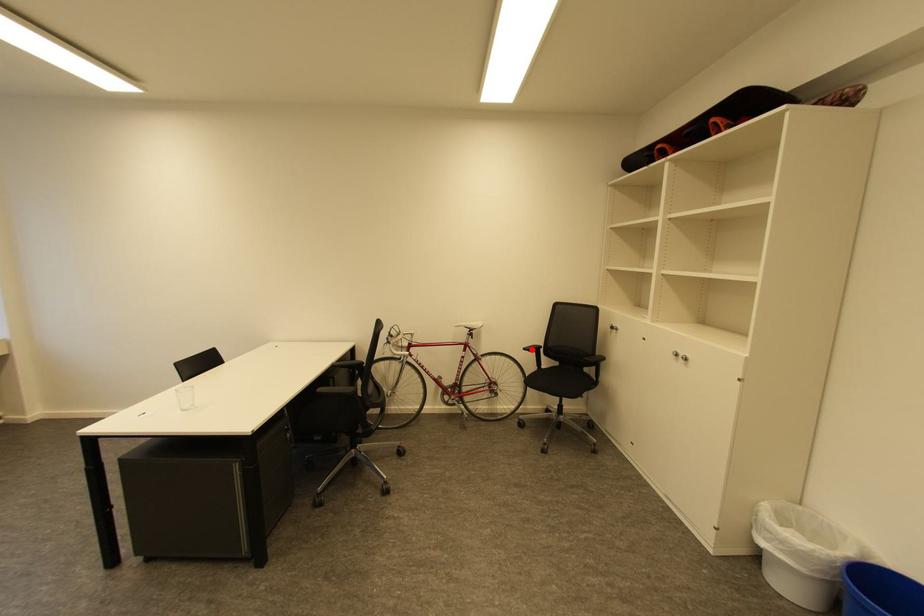
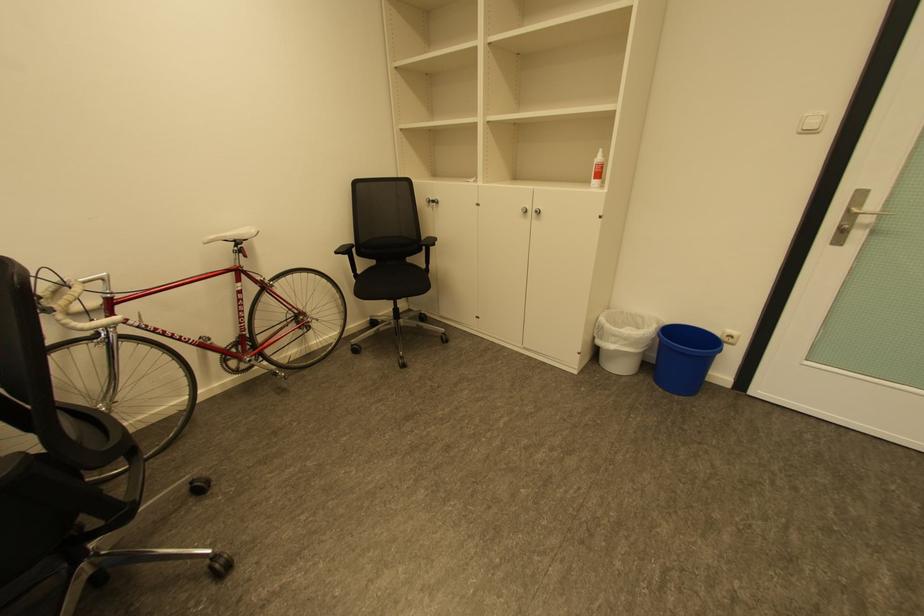
In the second image, find the point that corresponds to the highlighted location in the first image.

(344, 253)